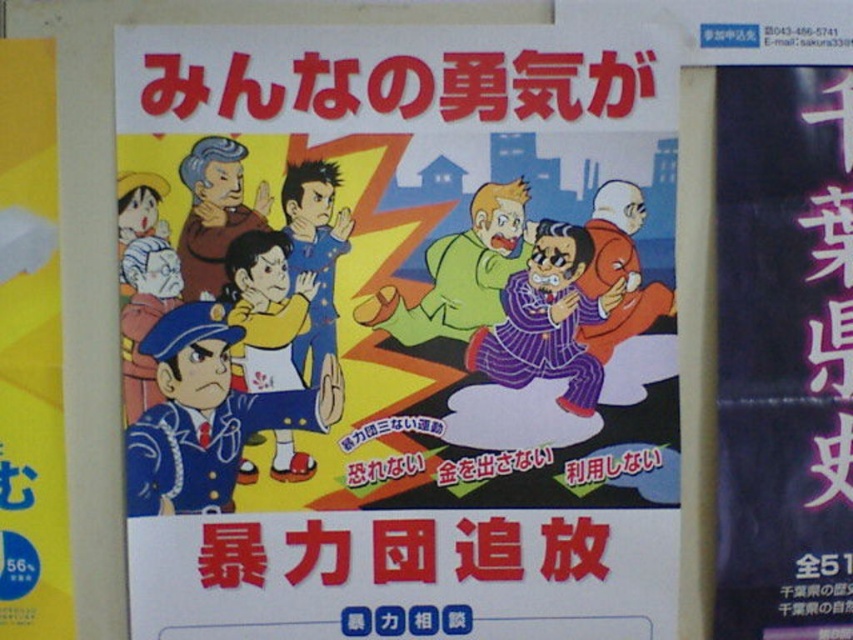
You are looking at the poster described. There are two points marked on it. The first point is at coordinate (463, 86) and the second point is at coordinate (753, 234). From your perspective, which point appears closer to you?

Point (463, 86) is in front of point (753, 234), so it appears closer to you.

You are standing in front of the poster and want to touch the point at coordinates (171,134). If your hand can reach up to 34 inches, will you be able to reach that point?

The point at (171,134) is 34.29 inches away from you. Since your hand can reach up to 34 inches, you will not be able to reach that point as it is slightly farther than your reach.